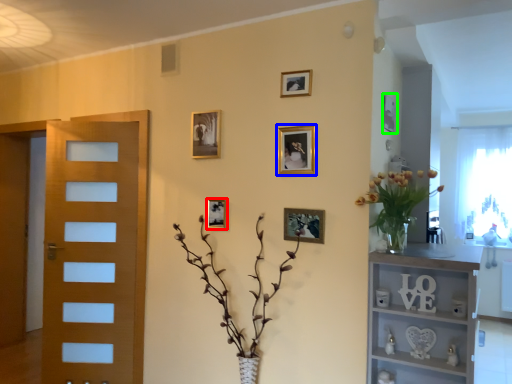
Question: Based on their relative distances, which object is nearer to picture frame (highlighted by a red box)? Choose from picture frame (highlighted by a blue box) and picture frame (highlighted by a green box).

Choices:
 (A) picture frame
 (B) picture frame

Answer: (A)